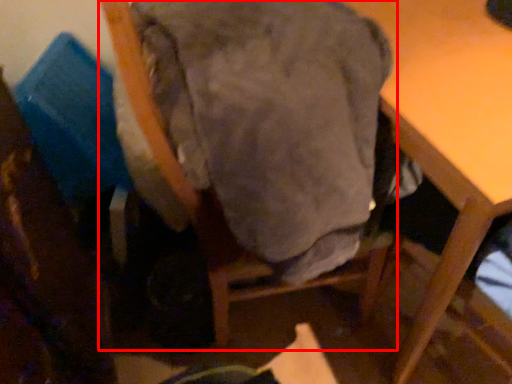
Question: From the image's perspective, considering the relative positions of chair (annotated by the red box) and table in the image provided, where is chair (annotated by the red box) located with respect to the staircase?

Choices:
 (A) above
 (B) below

Answer: (B)